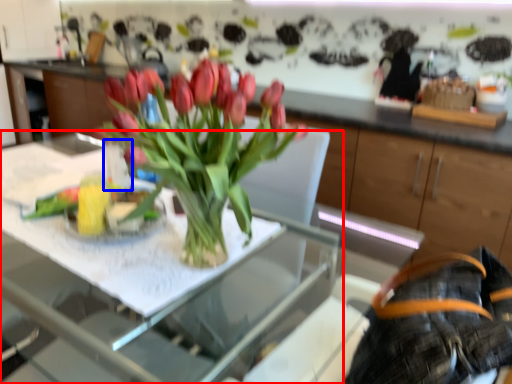
Question: Which point is further to the camera, table (highlighted by a red box) or vase (highlighted by a blue box)?

Choices:
 (A) table
 (B) vase

Answer: (B)